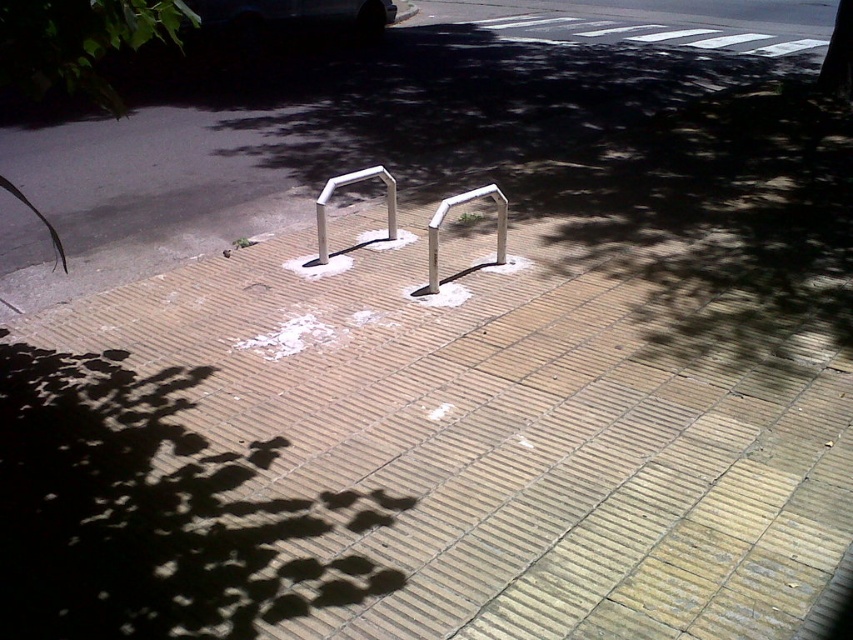
From the picture: Is white metallic rail at center to the left of silver metallic rail at center from the viewer's perspective?

Incorrect, white metallic rail at center is not on the left side of silver metallic rail at center.

Does point (437, 252) come closer to viewer compared to point (351, 173)?

That is True.

The image size is (853, 640). Identify the location of white metallic rail at center. (445, 212).

Is point (738, 384) more distant than point (322, 214)?

No, it is not.

Measure the distance between point (276,451) and camera.

9.53 feet

Find the location of a particular element. The width and height of the screenshot is (853, 640). brown brick pavement at center is located at coordinates 421,451.

Who is positioned more to the left, brown brick pavement at center or white metallic rail at center?

From the viewer's perspective, brown brick pavement at center appears more on the left side.

Is brown brick pavement at center positioned at the back of white metallic rail at center?

No, it is in front of white metallic rail at center.

You are a GUI agent. You are given a task and a screenshot of the screen. Output one action in this format:
    pyautogui.click(x=<x>, y=<y>)
    Task: Click on the brown brick pavement at center
    The width and height of the screenshot is (853, 640).
    Given the screenshot: What is the action you would take?
    pyautogui.click(x=421, y=451)